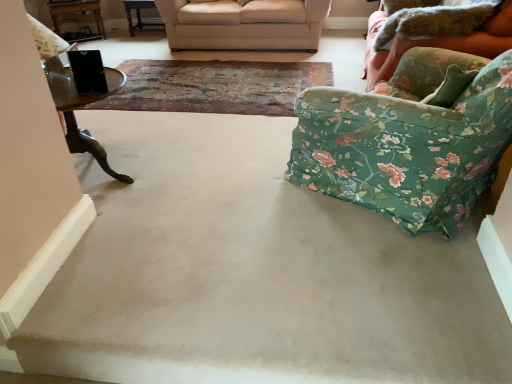
Question: From the image's perspective, would you say worn leather mat at center is shown under wooden table at upper left, the first table when ordered from left to right?

Choices:
 (A) yes
 (B) no

Answer: (A)

Question: Does worn leather mat at center appear on the left side of wooden table at upper left, the first table when ordered from left to right?

Choices:
 (A) no
 (B) yes

Answer: (A)

Question: Is worn leather mat at center shorter than wooden table at upper left, the first table when ordered from left to right?

Choices:
 (A) no
 (B) yes

Answer: (B)

Question: Does worn leather mat at center have a lesser width compared to wooden table at upper left, which ranks as the second table in right-to-left order?

Choices:
 (A) yes
 (B) no

Answer: (B)

Question: Would you consider worn leather mat at center to be distant from wooden table at upper left, the first table when ordered from left to right?

Choices:
 (A) yes
 (B) no

Answer: (A)

Question: Is beige fabric couch at upper center, the second studio couch positioned from the right, to the left or to the right of beige carpet at center in the image?

Choices:
 (A) right
 (B) left

Answer: (B)

Question: In the image, is beige fabric couch at upper center, the second studio couch positioned from the right, positioned in front of or behind beige carpet at center?

Choices:
 (A) behind
 (B) front

Answer: (A)

Question: Considering the positions of point (x=256, y=18) and point (x=245, y=336), is point (x=256, y=18) closer or farther from the camera than point (x=245, y=336)?

Choices:
 (A) farther
 (B) closer

Answer: (A)

Question: Looking at the image, does beige fabric couch at upper center, which is the first studio couch in back-to-front order, seem bigger or smaller compared to beige carpet at center?

Choices:
 (A) big
 (B) small

Answer: (A)

Question: Looking at their shapes, would you say floral fabric studio couch at right, the first studio couch when ordered from front to back, is wider or thinner than beige carpet at center?

Choices:
 (A) thin
 (B) wide

Answer: (B)

Question: From a real-world perspective, relative to beige carpet at center, is floral fabric studio couch at right, the 2th studio couch viewed from the left, vertically above or below?

Choices:
 (A) below
 (B) above

Answer: (B)

Question: From the image's perspective, is floral fabric studio couch at right, the 2th studio couch positioned from the back, above or below beige carpet at center?

Choices:
 (A) below
 (B) above

Answer: (B)

Question: Is floral fabric studio couch at right, the 2th studio couch positioned from the back, bigger or smaller than beige carpet at center?

Choices:
 (A) big
 (B) small

Answer: (A)

Question: From their relative heights in the image, would you say floral fabric armchair at right is taller or shorter than wooden table at upper left, which ranks as the second table in right-to-left order?

Choices:
 (A) short
 (B) tall

Answer: (B)

Question: From the image's perspective, is floral fabric armchair at right above or below wooden table at upper left, the first table when ordered from left to right?

Choices:
 (A) above
 (B) below

Answer: (B)